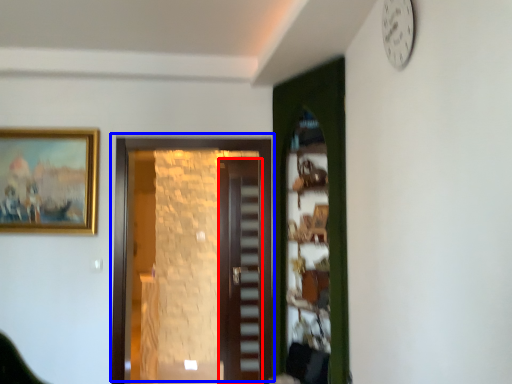
Question: Which point is closer to the camera, door (highlighted by a red box) or door (highlighted by a blue box)?

Choices:
 (A) door
 (B) door

Answer: (B)